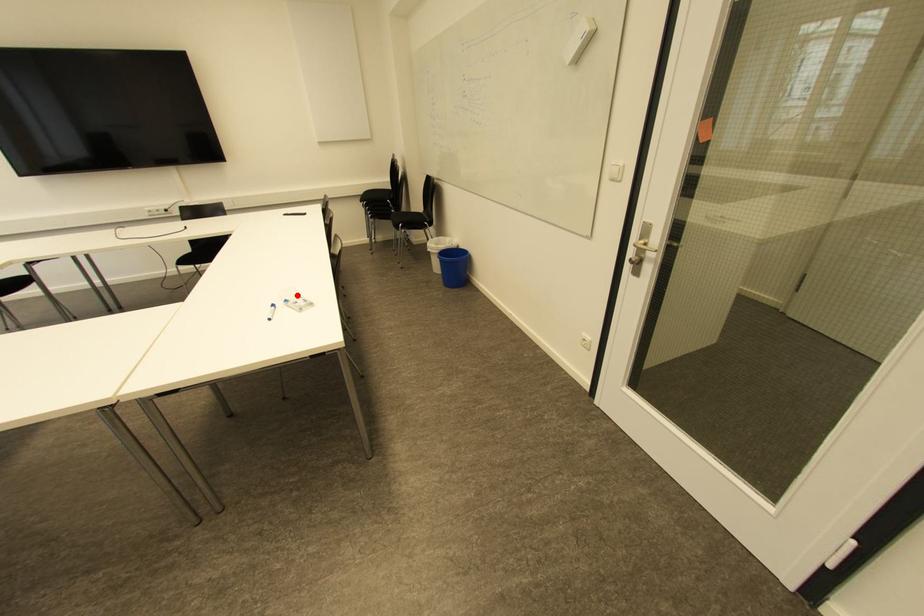
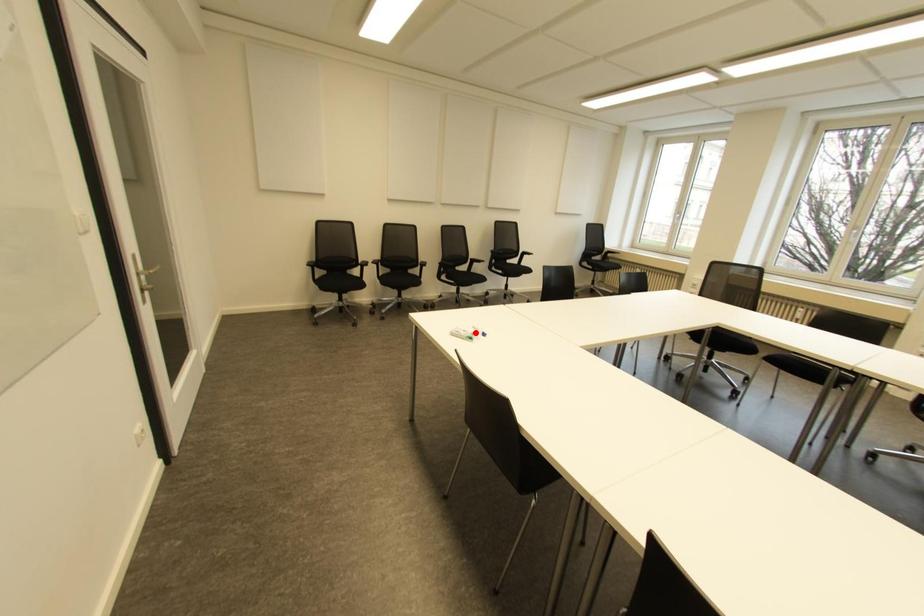
I am providing you with two images of the same scene from different viewpoints. A red point is marked on the first image and another point is marked on the second image. Do the highlighted points in image1 and image2 indicate the same real-world spot?

No